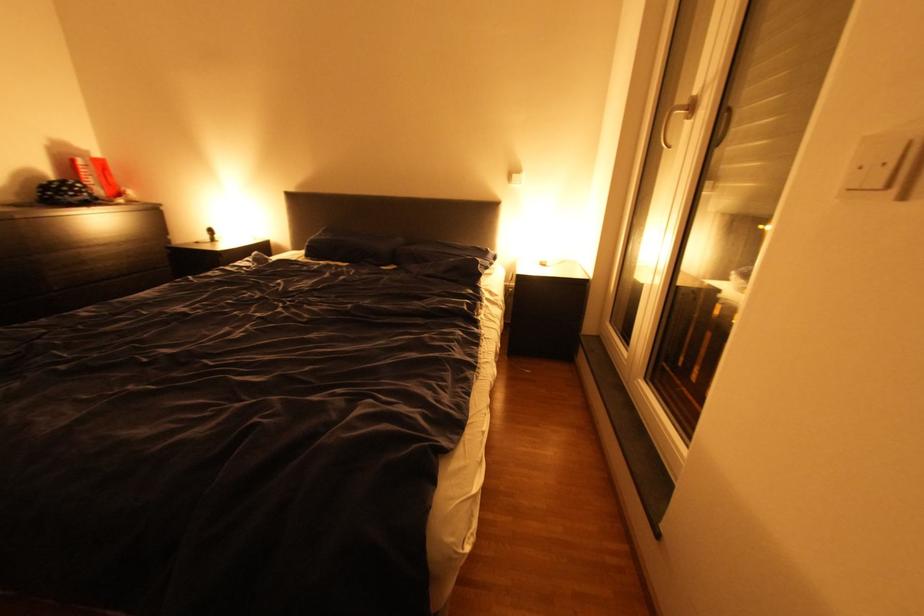
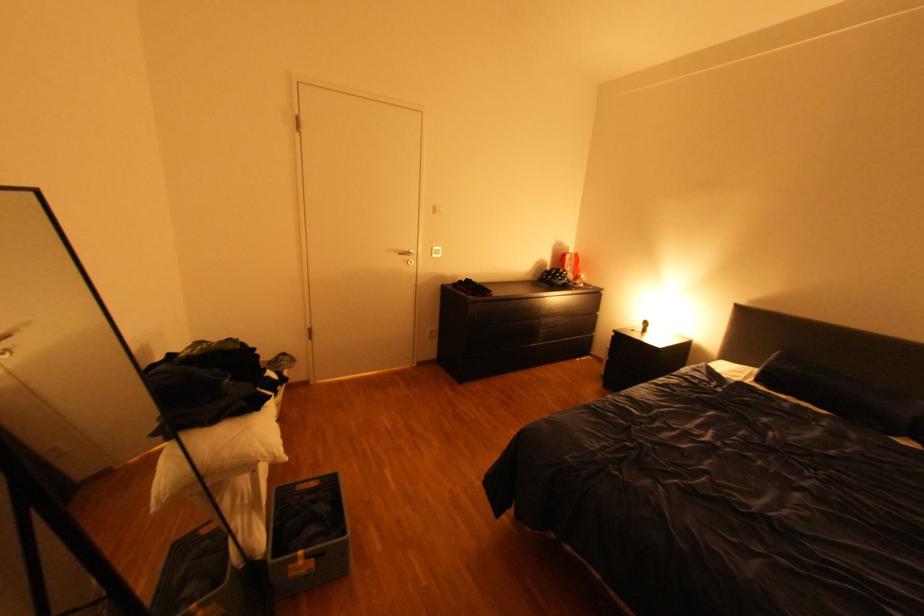
Locate, in the second image, the point that corresponds to (225,236) in the first image.

(659, 328)